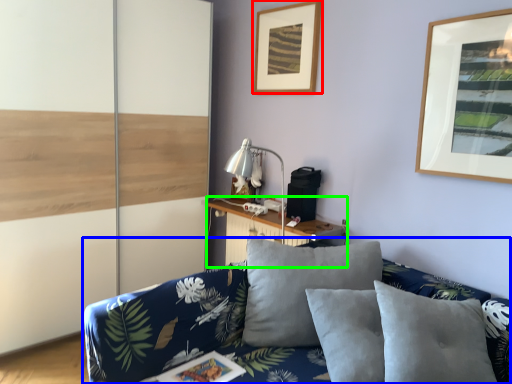
Question: Which object is positioned closest to picture frame (highlighted by a red box)? Select from studio couch (highlighted by a blue box) and table (highlighted by a green box).

Choices:
 (A) studio couch
 (B) table

Answer: (B)